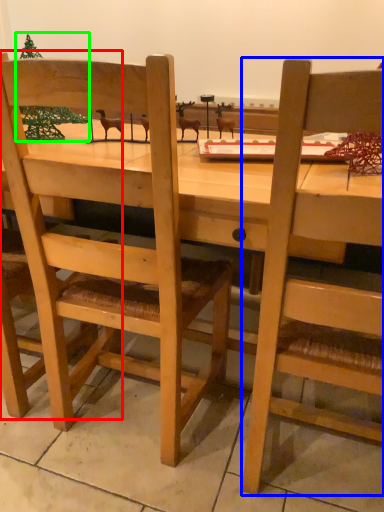
Question: Which object is positioned closest to chair (highlighted by a red box)? Select from chair (highlighted by a blue box) and christmas tree (highlighted by a green box).

Choices:
 (A) chair
 (B) christmas tree

Answer: (B)